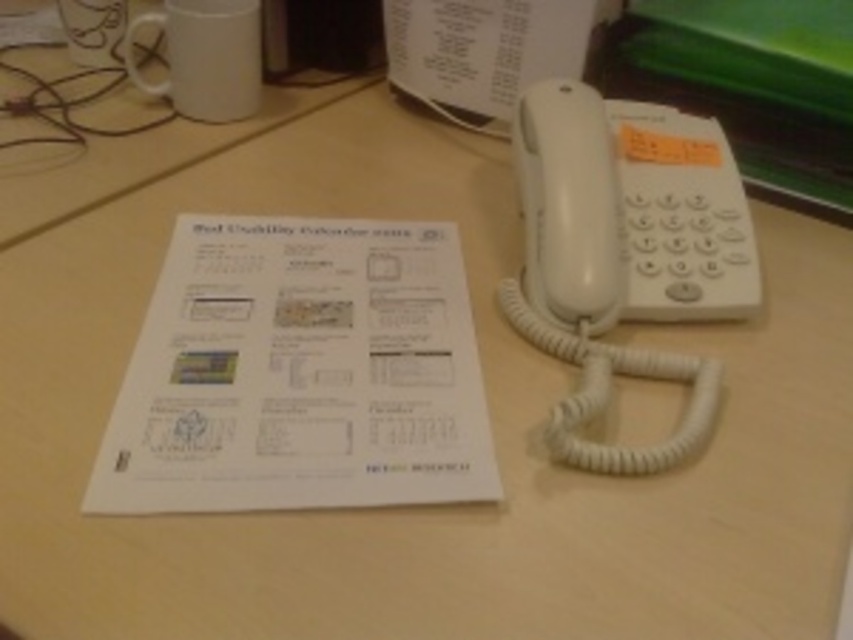
You are a delivery person who just arrived at a client office. You need to place a small package on the desk. The package is 16 inches long. If you want to place it on the white paper at center, will it fit entirely on the paper?

The white paper at center is 16.71 inches from viewer, so the package of 16 inches will fit entirely on the white paper at center since it is shorter than the paper.

You are a delivery person who needs to place a small package on the desk. The package must be placed exactly at the point marked by the coordinates point (300, 372). However, there is a white paper at center on the desk. Will placing the package at that point cover part of the white paper at center?

The point (300, 372) is on the white paper at center, so placing the package there will cover part of the white paper at center.

You are organizing items on a desk and need to place a new item between the white paper at center and the white plastic phone at right. Can you do this without moving either of them?

The white paper at center is below the white plastic phone at right, so there is no space between them for placing a new item without moving either object.